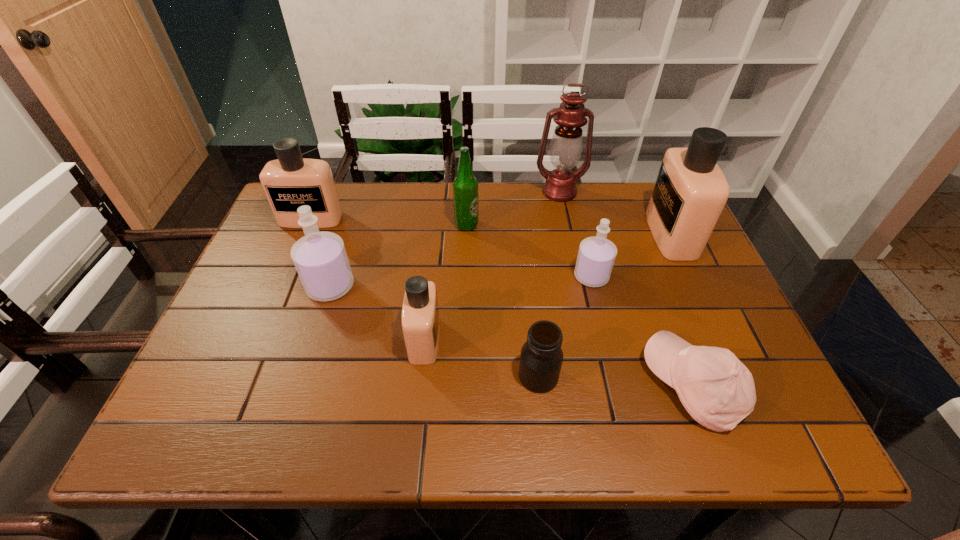
This screenshot has height=540, width=960. I want to click on free space at the right edge of the desktop, so click(x=660, y=271).

The height and width of the screenshot is (540, 960). Identify the location of free space at the near right corner of the desktop. (778, 403).

Locate an element on the screen. The height and width of the screenshot is (540, 960). free spot between the green beer bottle and the smaller purple perfume is located at coordinates (529, 251).

Find the location of a particular element. free space between the oil lamp and the second biggest beige perfume is located at coordinates (435, 206).

In order to click on vacant space in between the oil lamp and the right purple perfume in this screenshot , I will do `click(575, 234)`.

At what (x,y) coordinates should I click in order to perform the action: click on empty space between the leftmost beige perfume and the biggest beige perfume. Please return your answer as a coordinate pair (x, y). Looking at the image, I should click on (x=491, y=227).

You are a GUI agent. You are given a task and a screenshot of the screen. Output one action in this format:
    pyautogui.click(x=<x>, y=<y>)
    Task: Click on the free space that is in between the nearest perfume and the green beer bottle
    
    Given the screenshot: What is the action you would take?
    pyautogui.click(x=445, y=282)

Where is `vacant area that lies between the smaller purple perfume and the baseball cap`? This screenshot has height=540, width=960. vacant area that lies between the smaller purple perfume and the baseball cap is located at coordinates (642, 331).

The image size is (960, 540). I want to click on vacant space that's between the third perfume from left to right and the green beer bottle, so click(x=445, y=282).

The width and height of the screenshot is (960, 540). What are the coordinates of `vacant point located between the left purple perfume and the beer bottle` in the screenshot? It's located at (398, 256).